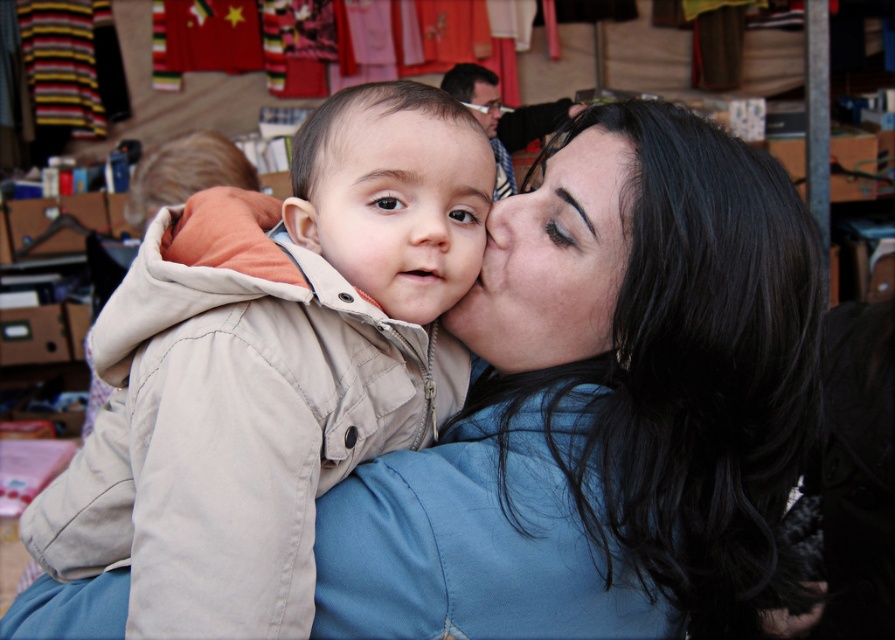
You are a photographer at the market and want to capture a closeup of the smooth skin face at center without the matte beige jacket at center blocking it. What adjustment should you make to your camera angle?

To capture the smooth skin face at center without the matte beige jacket at center blocking it, you should adjust your camera angle to position it behind the matte beige jacket at center so that the jacket is no longer in front of the face.